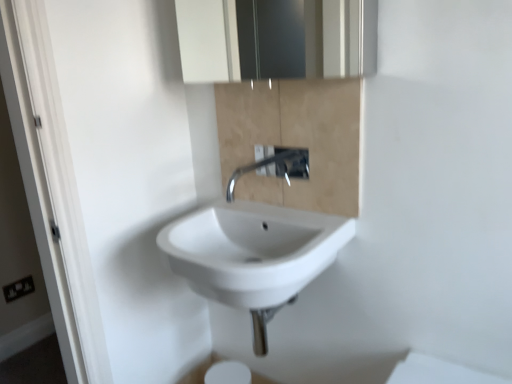
Question: Does black plastic electrical outlet at lower left appear on the left side of satin chrome faucet at center?

Choices:
 (A) no
 (B) yes

Answer: (B)

Question: Would you say satin chrome faucet at center is part of black plastic electrical outlet at lower left's contents?

Choices:
 (A) no
 (B) yes

Answer: (A)

Question: Is black plastic electrical outlet at lower left thinner than satin chrome faucet at center?

Choices:
 (A) no
 (B) yes

Answer: (B)

Question: Could you tell me if black plastic electrical outlet at lower left is facing satin chrome faucet at center?

Choices:
 (A) no
 (B) yes

Answer: (A)

Question: From a real-world perspective, does black plastic electrical outlet at lower left sit lower than satin chrome faucet at center?

Choices:
 (A) no
 (B) yes

Answer: (B)

Question: From the image's perspective, is white glossy medicine cabinet at upper center above or below black plastic electrical outlet at lower left?

Choices:
 (A) above
 (B) below

Answer: (A)

Question: Considering the relative positions of white glossy medicine cabinet at upper center and black plastic electrical outlet at lower left in the image provided, is white glossy medicine cabinet at upper center to the left or to the right of black plastic electrical outlet at lower left?

Choices:
 (A) left
 (B) right

Answer: (B)

Question: Looking at the image, does white glossy medicine cabinet at upper center seem bigger or smaller compared to black plastic electrical outlet at lower left?

Choices:
 (A) small
 (B) big

Answer: (B)

Question: Is white glossy medicine cabinet at upper center in front of or behind black plastic electrical outlet at lower left in the image?

Choices:
 (A) behind
 (B) front

Answer: (B)

Question: Considering the positions of black plastic electrical outlet at lower left and beige marble cabinet at center in the image, is black plastic electrical outlet at lower left wider or thinner than beige marble cabinet at center?

Choices:
 (A) thin
 (B) wide

Answer: (A)

Question: In terms of height, does black plastic electrical outlet at lower left look taller or shorter compared to beige marble cabinet at center?

Choices:
 (A) tall
 (B) short

Answer: (B)

Question: Is black plastic electrical outlet at lower left in front of or behind beige marble cabinet at center in the image?

Choices:
 (A) front
 (B) behind

Answer: (B)

Question: Choose the correct answer: Is black plastic electrical outlet at lower left inside beige marble cabinet at center or outside it?

Choices:
 (A) outside
 (B) inside

Answer: (A)

Question: Choose the correct answer: Is satin chrome faucet at center inside white glossy sink at center or outside it?

Choices:
 (A) inside
 (B) outside

Answer: (B)

Question: Considering their positions, is satin chrome faucet at center located in front of or behind white glossy sink at center?

Choices:
 (A) front
 (B) behind

Answer: (B)